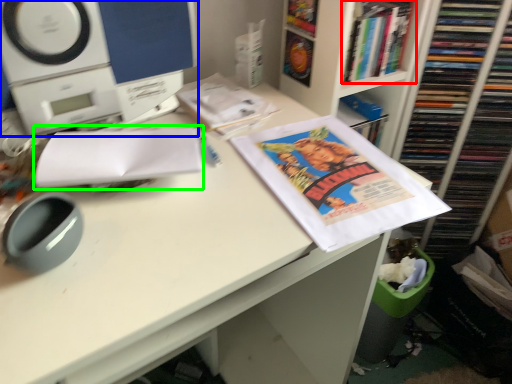
Question: Estimate the real-world distances between objects in this image. Which object is closer to book (highlighted by a red box), home appliance (highlighted by a blue box) or paperback book (highlighted by a green box)?

Choices:
 (A) home appliance
 (B) paperback book

Answer: (A)